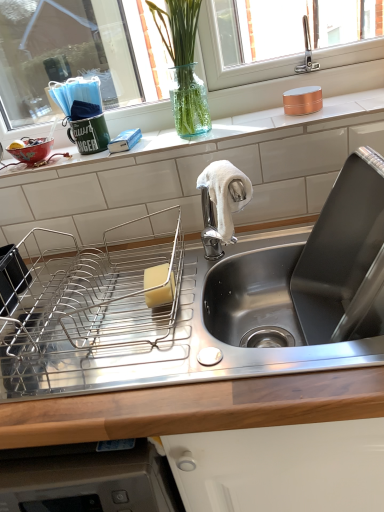
Locate an element on the screen. vacant area that lies between transparent glass vase at upper center and copper metallic canister at upper right, positioned as the 1th appliance in right-to-left order is located at coordinates (264, 119).